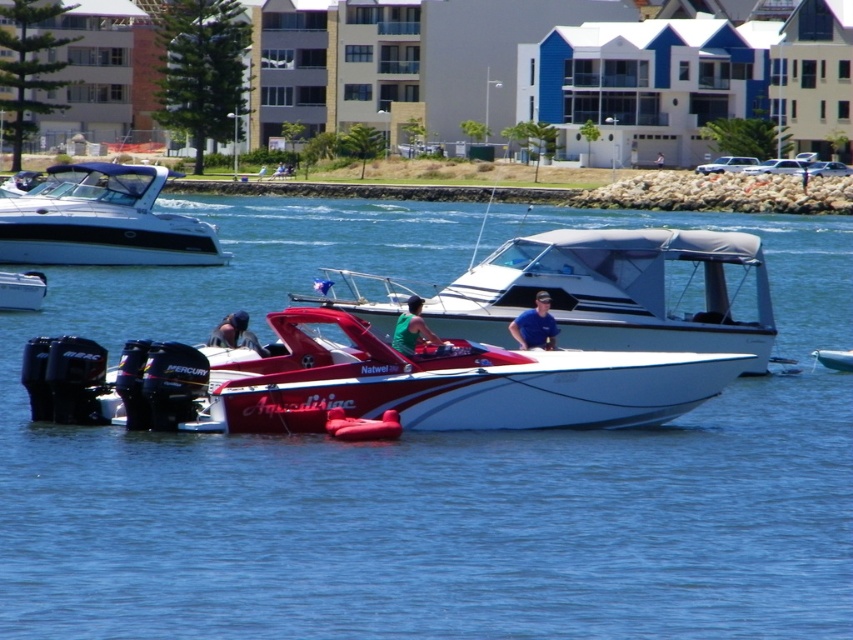
You are a photographer trying to capture a clear shot of both the metallic silver boat at lower left and the green matte shirt at center. Based on their positions, which object is higher up in the image?

The metallic silver boat at lower left is higher up in the image than the green matte shirt at center because it is positioned above the latter according to the description.

You are a photographer planning to capture a photo of the white glossy motorboat at upper left and the matte black helmet at lower left. Considering their heights, which object should you focus on first to ensure both are in frame without needing to adjust the camera angle?

The white glossy motorboat at upper left is taller than the matte black helmet at lower left. To ensure both are in frame without adjusting the camera angle, focus on the white glossy motorboat at upper left first, as its greater height means it will occupy more of the vertical space, allowing the shorter matte black helmet at lower left to naturally fit within the same frame.